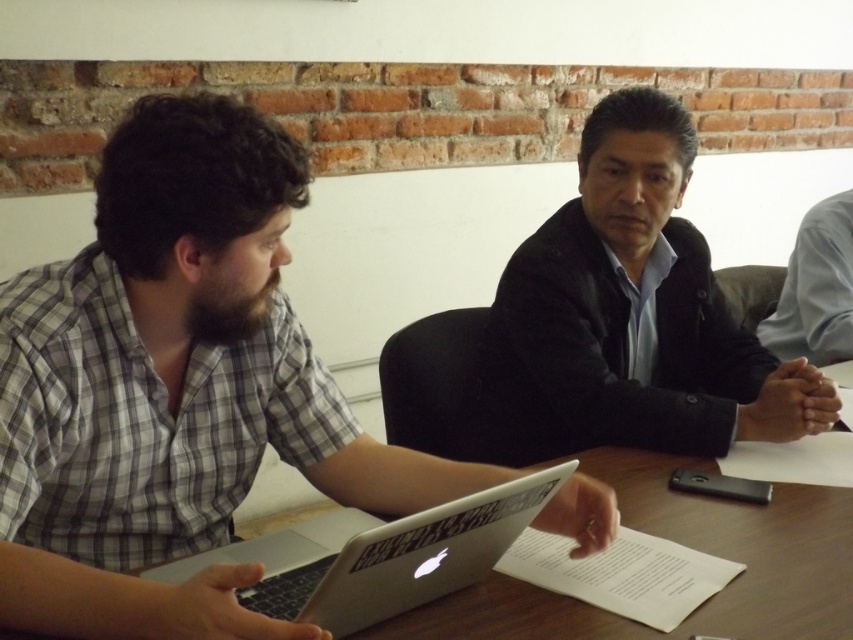
You are a delivery person who needs to place a small package between the black leather jacket at center and the silver metallic laptop at center on the table. The package is 12 inches long. Is there enough space between them to fit the package?

The distance between the black leather jacket at center and the silver metallic laptop at center is 25.47 inches. Since the package is only 12 inches long, there is sufficient space to place it between them.

You are a photographer trying to capture a closeup of the silver metallic laptop at center without the black leather jacket at center blocking the view. Is this possible given their positions?

The black leather jacket at center is further to the viewer than the silver metallic laptop at center, so the jacket is closer to you and would block the view of the laptop. You need to move the jacket or adjust your angle to see the laptop.